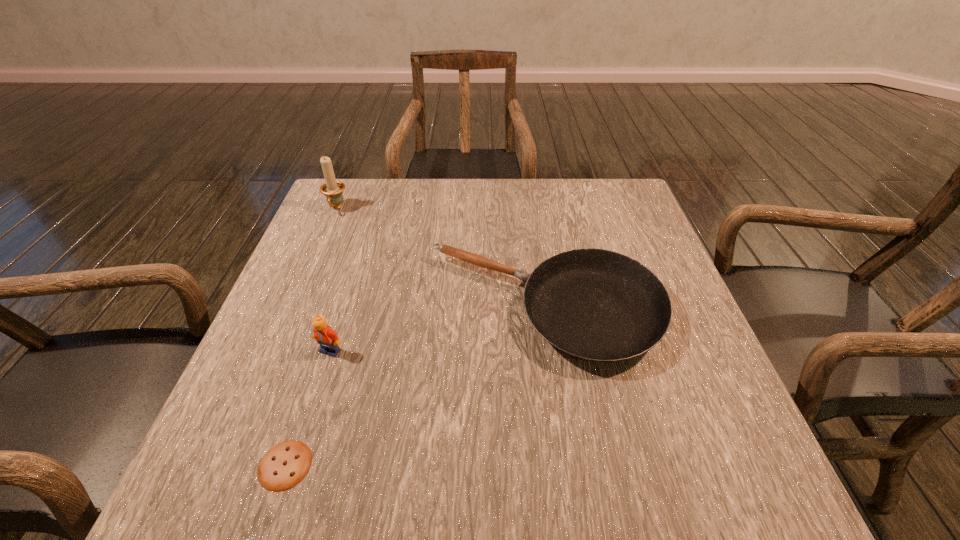
The width and height of the screenshot is (960, 540). What are the coordinates of `unoccupied area between the Lego and the cookie` in the screenshot? It's located at (308, 408).

The height and width of the screenshot is (540, 960). In order to click on vacant area between the leftmost object and the Lego in this screenshot , I will do `click(333, 280)`.

Find the location of `empty space that is in between the third shortest object and the frying pan`. empty space that is in between the third shortest object and the frying pan is located at coordinates (x=438, y=329).

Locate an element on the screen. The image size is (960, 540). free space between the nearest object and the frying pan is located at coordinates (415, 387).

Where is `vacant area that lies between the leftmost object and the Lego`? The height and width of the screenshot is (540, 960). vacant area that lies between the leftmost object and the Lego is located at coordinates (333, 280).

You are a GUI agent. You are given a task and a screenshot of the screen. Output one action in this format:
    pyautogui.click(x=<x>, y=<y>)
    Task: Click on the free space that is in between the nearest object and the farthest object
    This screenshot has height=540, width=960.
    Given the screenshot: What is the action you would take?
    311,337

Identify the location of vacant point located between the third shortest object and the cookie. (308, 408).

Identify which object is the third closest to the Lego. Please provide its 2D coordinates. Your answer should be formatted as a tuple, i.e. [(x, y)], where the tuple contains the x and y coordinates of a point satisfying the conditions above.

[(332, 189)]

I want to click on object that is the third nearest to the farthest object, so click(x=286, y=464).

The height and width of the screenshot is (540, 960). Identify the location of vacant area that satisfies the following two spatial constraints: 1. on the handle side of the candle_holder; 2. on the left side of the second shortest object. (295, 308).